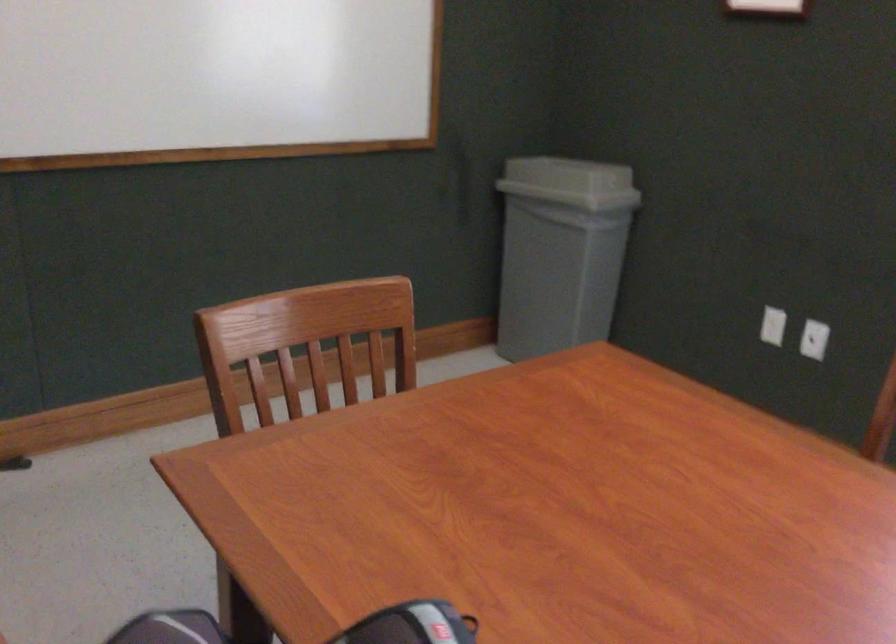
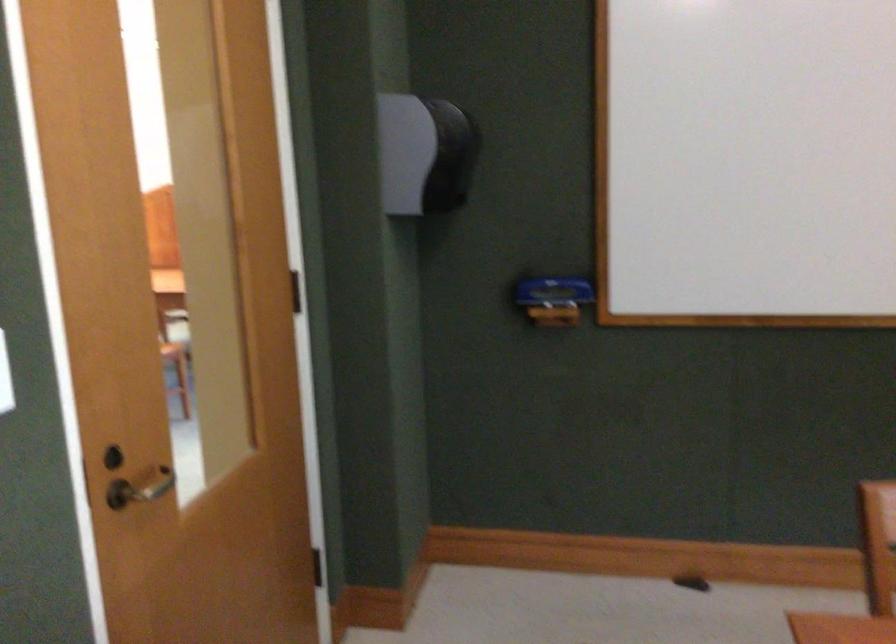
Question: The first image is from the beginning of the video and the second image is from the end. How did the camera likely rotate when shooting the video?

Choices:
 (A) Left
 (B) Right
 (C) Up
 (D) Down

Answer: (A)